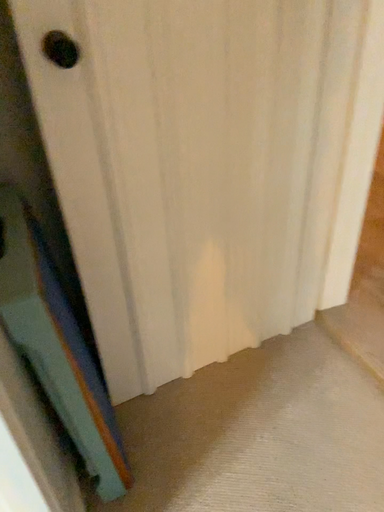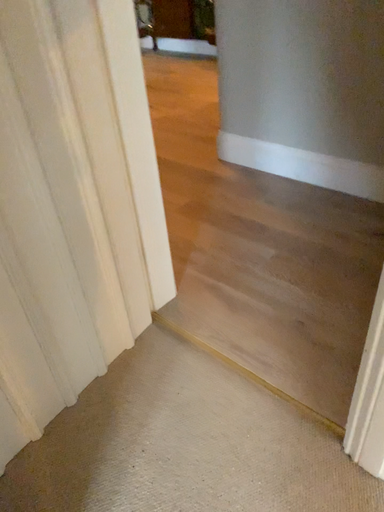
Question: Which way did the camera rotate in the video?

Choices:
 (A) rotated left
 (B) rotated right

Answer: (B)